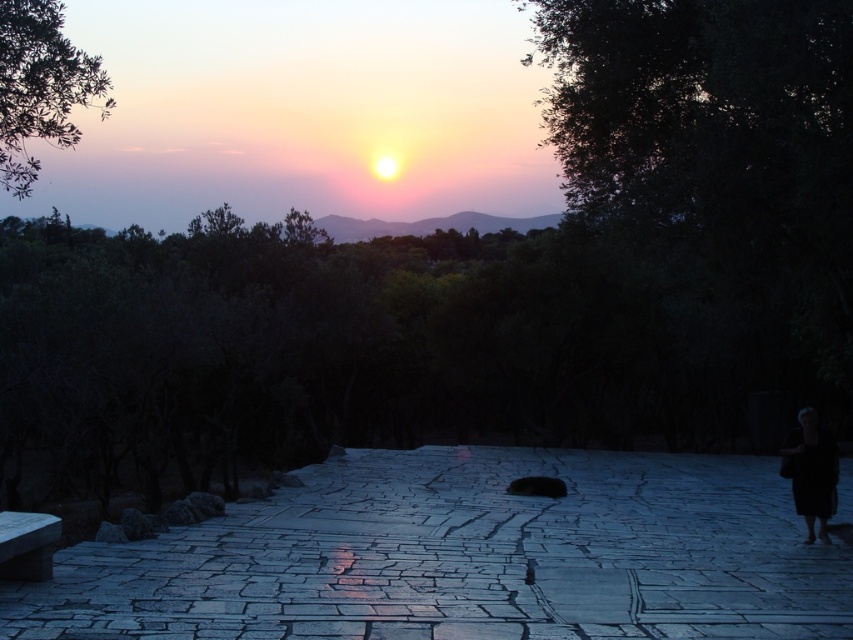
Can you confirm if gray stone path at center is bigger than black fabric bag at lower right?

Correct, gray stone path at center is larger in size than black fabric bag at lower right.

Who is positioned more to the right, gray stone path at center or black fabric bag at lower right?

From the viewer's perspective, black fabric bag at lower right appears more on the right side.

This screenshot has width=853, height=640. I want to click on gray stone path at center, so pyautogui.click(x=465, y=557).

You are a GUI agent. You are given a task and a screenshot of the screen. Output one action in this format:
    pyautogui.click(x=<x>, y=<y>)
    Task: Click on the gray stone path at center
    
    Given the screenshot: What is the action you would take?
    coord(465,557)